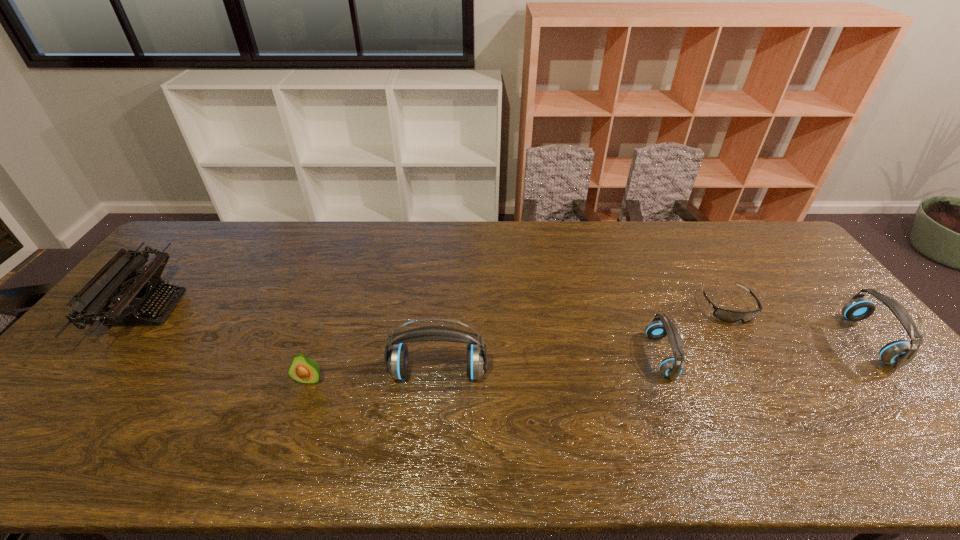
Where is `the tallest object`? The width and height of the screenshot is (960, 540). the tallest object is located at coordinates 397,357.

In order to click on the leftmost headset in this screenshot , I will do `click(397, 357)`.

Locate an element on the screen. This screenshot has height=540, width=960. the third object from right to left is located at coordinates (661, 326).

I want to click on the second headset from left to right, so click(x=661, y=326).

I want to click on the second tallest headset, so click(899, 353).

I want to click on the rightmost headset, so click(899, 353).

This screenshot has width=960, height=540. In order to click on the fifth object from left to right in this screenshot , I will do `click(730, 316)`.

Where is `goggles`? The width and height of the screenshot is (960, 540). goggles is located at coordinates point(730,316).

I want to click on typewriter, so click(x=115, y=283).

This screenshot has height=540, width=960. Identify the location of the second object from left to right. (302, 369).